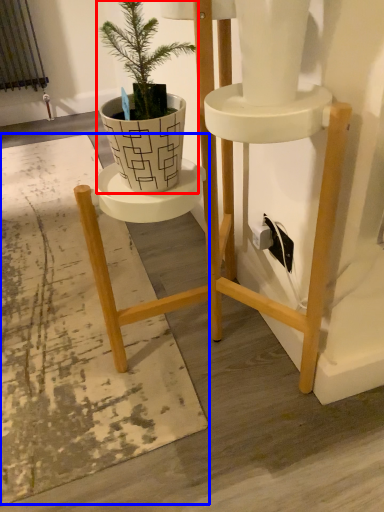
Question: Among these objects, which one is farthest to the camera, houseplant (highlighted by a red box) or mat (highlighted by a blue box)?

Choices:
 (A) houseplant
 (B) mat

Answer: (B)